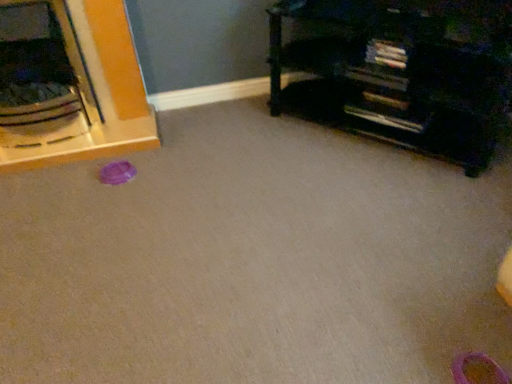
The height and width of the screenshot is (384, 512). Find the location of `vacant area that is in front of brushed metal bowl at left, the second furniture viewed from the right`. vacant area that is in front of brushed metal bowl at left, the second furniture viewed from the right is located at coordinates (71, 201).